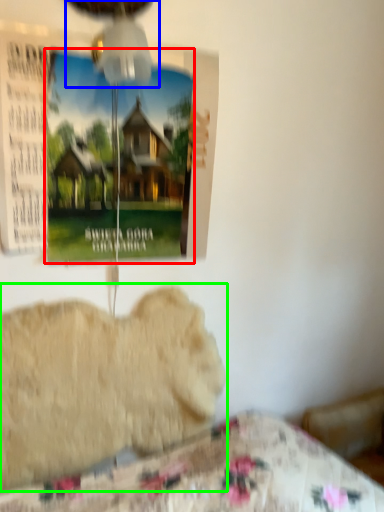
Question: Which object is positioned closest to poster page (highlighted by a red box)? Select from mechanical fan (highlighted by a blue box) and animal (highlighted by a green box).

Choices:
 (A) mechanical fan
 (B) animal

Answer: (A)